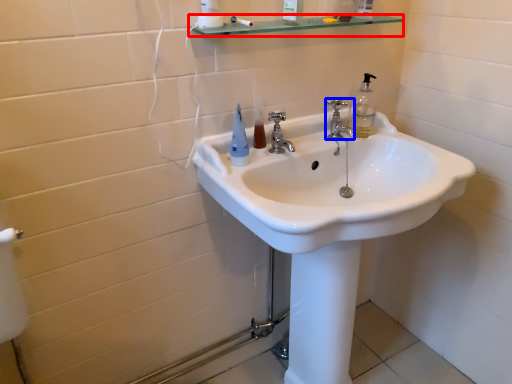
Question: Which object is closer to the camera taking this photo, balustrade (highlighted by a red box) or tap (highlighted by a blue box)?

Choices:
 (A) balustrade
 (B) tap

Answer: (A)